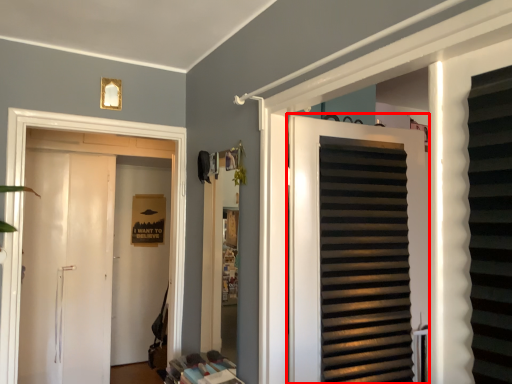
Question: From the image, what is the correct spatial relationship of door (annotated by the red box) in relation to door?

Choices:
 (A) left
 (B) right

Answer: (B)